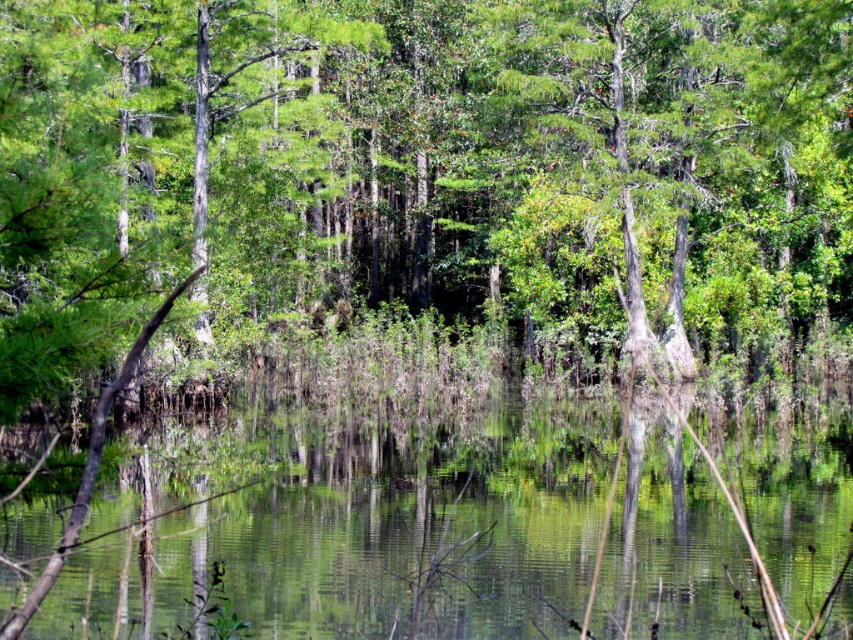
You are a bird flying over a swamp. You need to land on either the green matte tree at center or the green reflective water at center. Which one is taller and suitable for landing?

The green matte tree at center is taller than the green reflective water at center, so it is suitable for landing.

Consider the image. You are standing on a path that runs along the edge of the swamp. You notice a green matte tree at center and a green reflective water at center. Which object is positioned to the right of the other?

The green matte tree at center is to the right of the green reflective water at center.

You are standing at the origin point of the swamp scene. Where is the green matte tree at center located in terms of coordinates?

The green matte tree at center is located at coordinates point (424, 176).